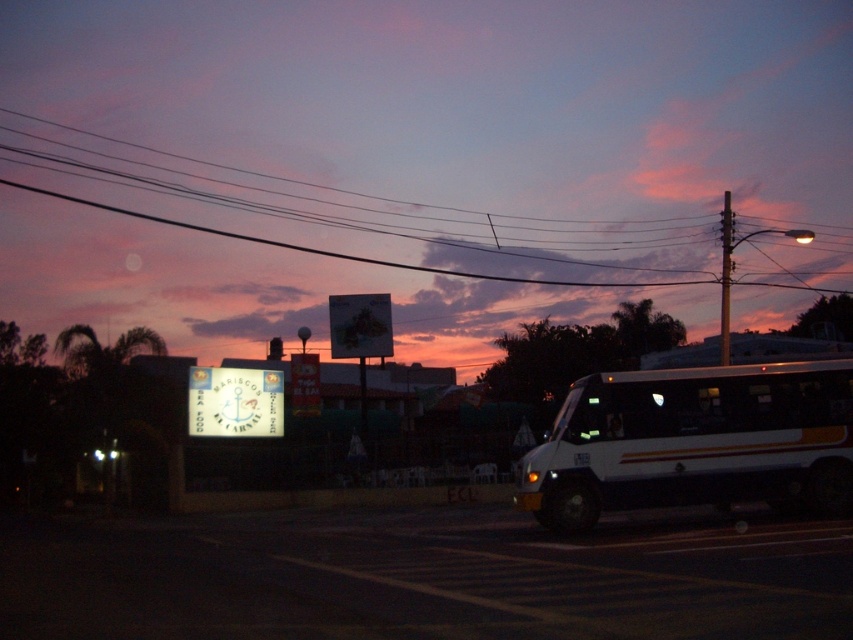
You are a pedestrian waiting at the crosswalk on the road. You notice the white matte bus at center and the matte pink sky at upper center. Which object is closer to you as you stand at the crosswalk?

The matte pink sky at upper center is closer to you because the white matte bus at center is behind it.